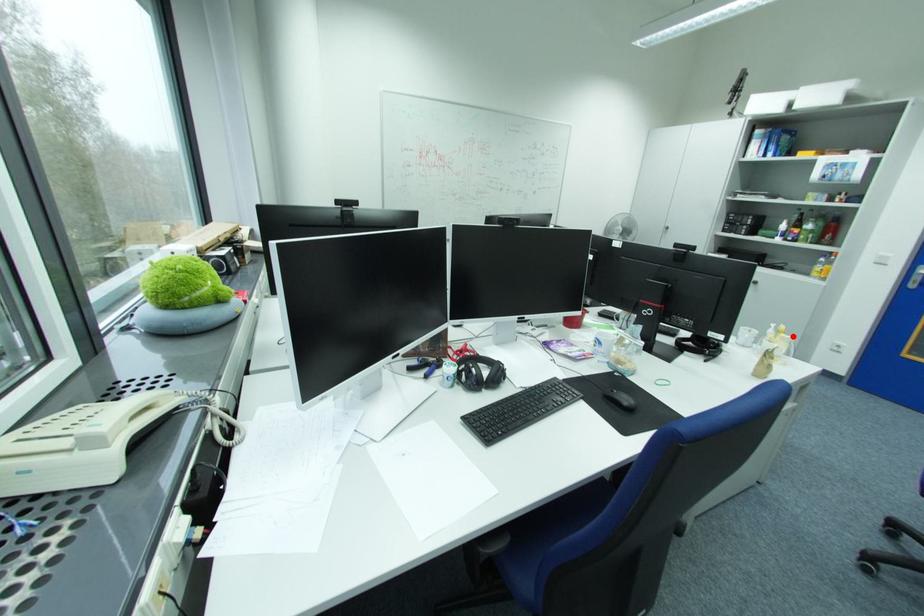
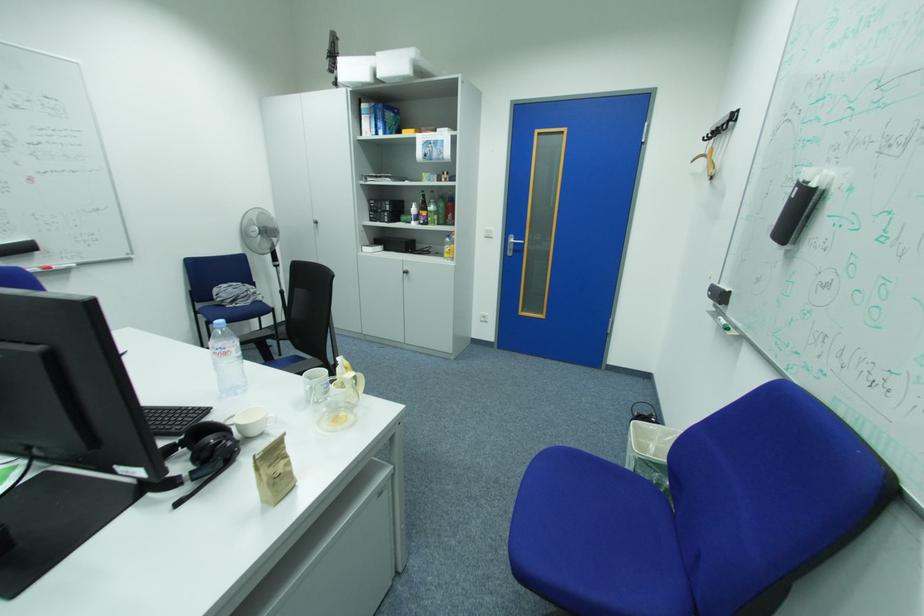
The point at the highlighted location is marked in the first image. Where is the corresponding point in the second image?

(359, 374)